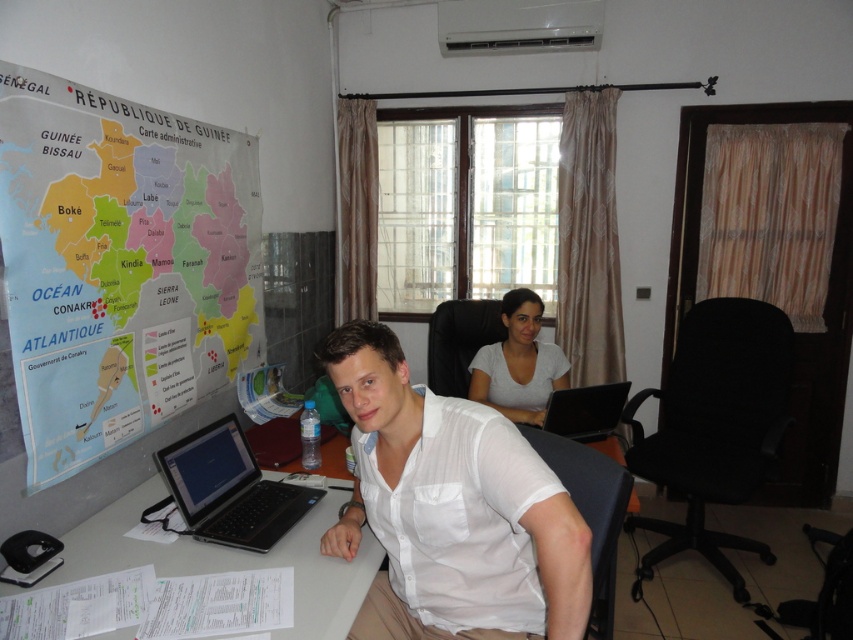
In the scene shown: Can you confirm if white matte shirt at center is wider than black glossy laptop at center?

Yes.

Is white matte shirt at center bigger than black glossy laptop at center?

Yes.

This screenshot has width=853, height=640. What do you see at coordinates (450, 509) in the screenshot?
I see `white matte shirt at center` at bounding box center [450, 509].

Identify the location of white matte shirt at center. (450, 509).

Is black glossy laptop at lower left to the right of black glossy laptop at center from the viewer's perspective?

Incorrect, black glossy laptop at lower left is not on the right side of black glossy laptop at center.

Does black glossy laptop at lower left have a greater width compared to black glossy laptop at center?

Yes.

Which is in front, point (201, 540) or point (543, 426)?

Point (201, 540)

This screenshot has width=853, height=640. In order to click on black glossy laptop at lower left in this screenshot , I will do `click(229, 490)`.

Find the location of `white matte shirt at center`. white matte shirt at center is located at coordinates (450, 509).